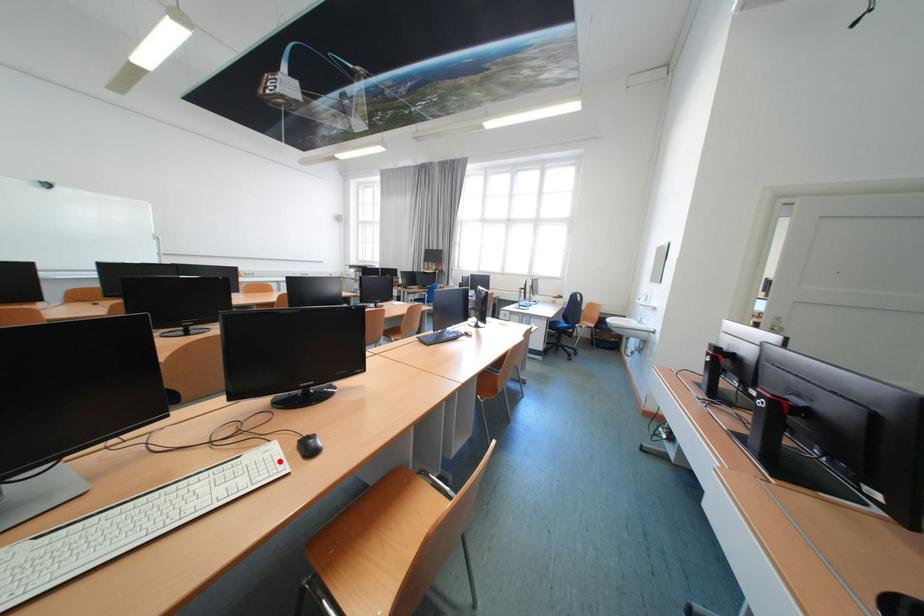
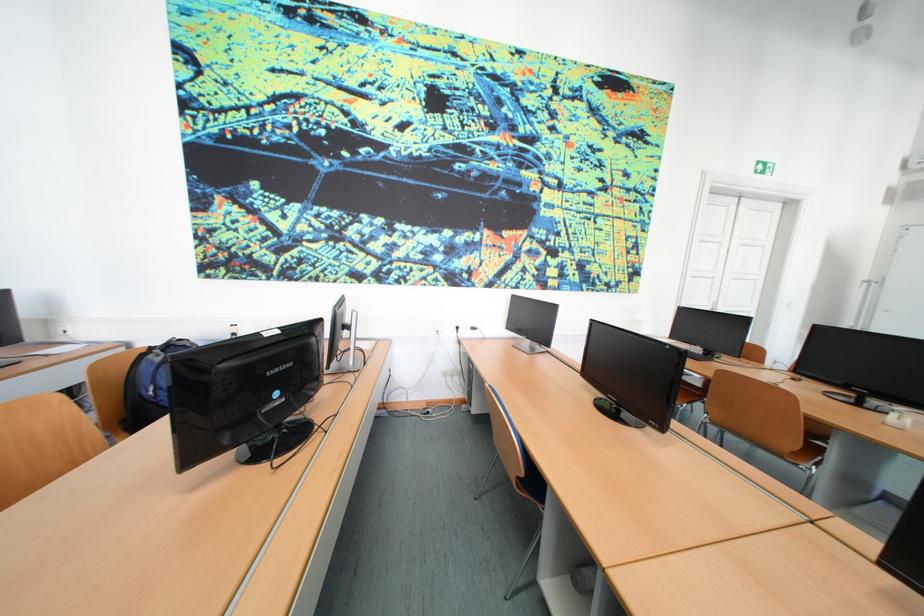
Question: I am providing you with two images of the same scene from different viewpoints. A red point is marked on the first image. Is the red point's position out of view in image 2?

Choices:
 (A) Yes
 (B) No

Answer: (A)